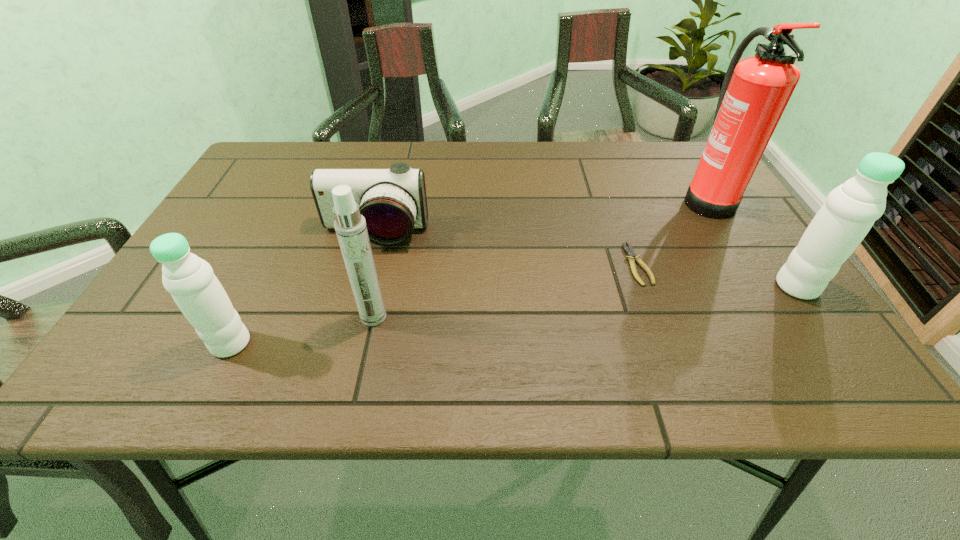
Identify the location of vacant space at the far right corner. The height and width of the screenshot is (540, 960). (662, 162).

Where is `free space at the near right corner of the desktop`? free space at the near right corner of the desktop is located at coordinates (735, 313).

At what (x,y) coordinates should I click in order to perform the action: click on empty location between the fire extinguisher and the camcorder. Please return your answer as a coordinate pair (x, y). Looking at the image, I should click on click(540, 216).

Find the location of a particular element. The image size is (960, 540). free space between the pliers and the fifth farthest object is located at coordinates coord(506,291).

Where is `blank region between the right water bottle and the fifth farthest object`? The width and height of the screenshot is (960, 540). blank region between the right water bottle and the fifth farthest object is located at coordinates (586, 302).

Locate an element on the screen. Image resolution: width=960 pixels, height=540 pixels. free spot between the tallest object and the fifth farthest object is located at coordinates (540, 257).

The width and height of the screenshot is (960, 540). I want to click on vacant point located between the aerosol can and the third object from right to left, so click(x=506, y=291).

At what (x,y) coordinates should I click in order to perform the action: click on free area in between the tallest object and the fourth tallest object. Please return your answer as a coordinate pair (x, y). Looking at the image, I should click on (468, 271).

Locate an element on the screen. This screenshot has width=960, height=540. free space that is in between the shorter water bottle and the fire extinguisher is located at coordinates (468, 271).

This screenshot has height=540, width=960. In order to click on vacant area between the second nearest object and the pliers in this screenshot , I will do `click(506, 291)`.